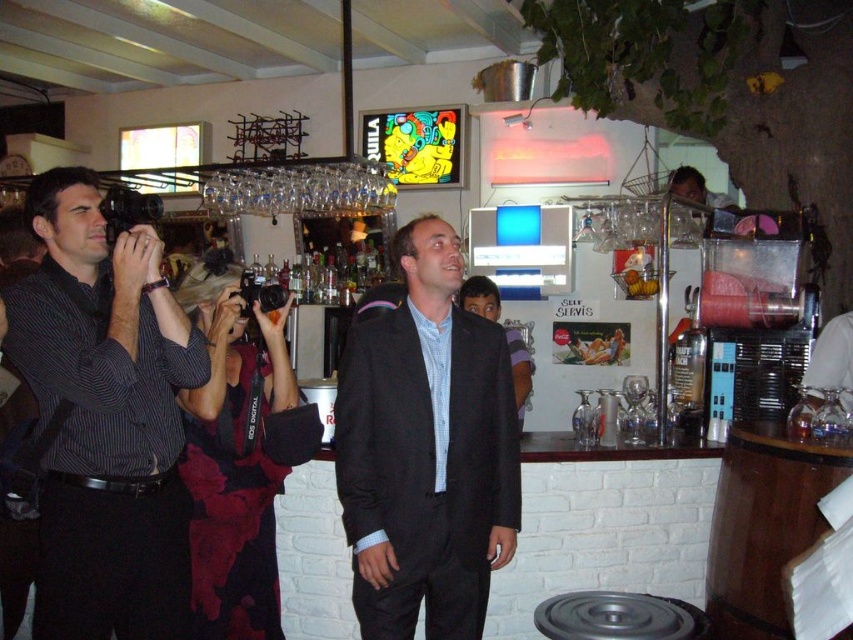
Question: Among these objects, which one is farthest from the camera?

Choices:
 (A) black matte suit at center
 (B) striped cotton shirt at left

Answer: (A)

Question: Is striped cotton shirt at left smaller than black matte suit at center?

Choices:
 (A) yes
 (B) no

Answer: (B)

Question: Can you confirm if striped cotton shirt at left is smaller than black matte suit at center?

Choices:
 (A) yes
 (B) no

Answer: (B)

Question: Can you confirm if striped cotton shirt at left is thinner than black matte suit at center?

Choices:
 (A) yes
 (B) no

Answer: (A)

Question: Which of the following is the farthest from the observer?

Choices:
 (A) black matte suit at center
 (B) striped cotton shirt at left

Answer: (A)